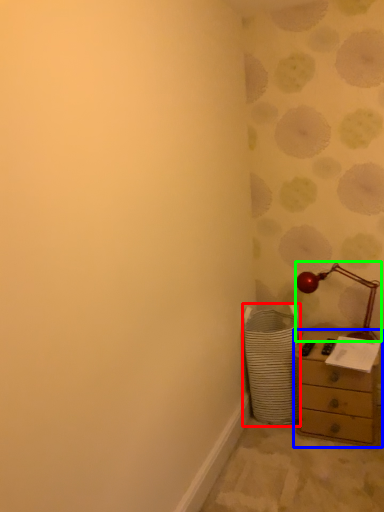
Question: Which is farther away from laundry basket (highlighted by a red box)? chest of drawers (highlighted by a blue box) or table lamp (highlighted by a green box)?

Choices:
 (A) chest of drawers
 (B) table lamp

Answer: (B)